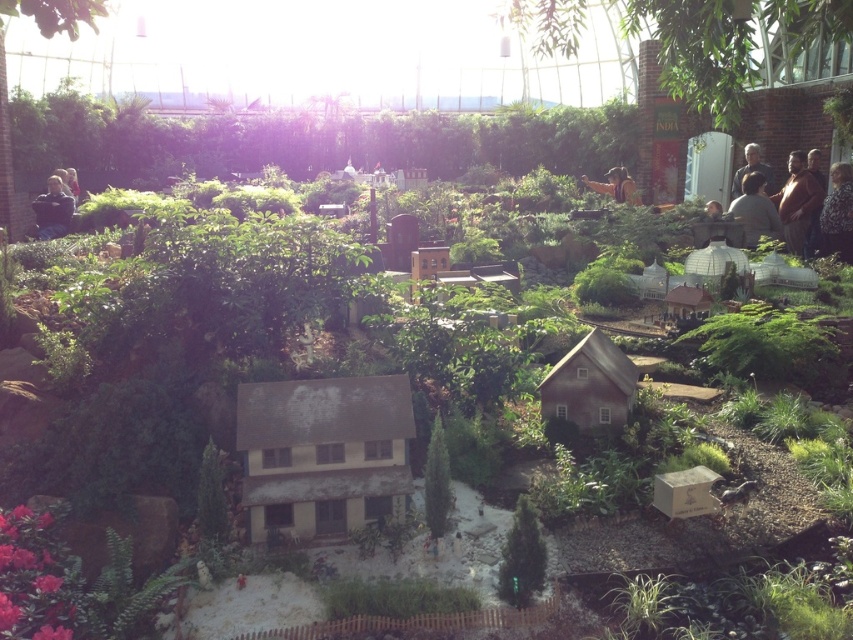
Does dark blue shirt at left appear under gray hair at upper right?

Indeed, dark blue shirt at left is positioned under gray hair at upper right.

Is dark blue shirt at left smaller than gray hair at upper right?

No.

Measure the distance between point (45, 204) and camera.

The distance of point (45, 204) from camera is 10.29 meters.

The width and height of the screenshot is (853, 640). What are the coordinates of `dark blue shirt at left` in the screenshot? It's located at (51, 209).

The image size is (853, 640). Describe the element at coordinates (310, 141) in the screenshot. I see `green leafy plants at upper center` at that location.

Does green leafy plants at upper center have a lesser width compared to brown leather jacket at upper center?

Incorrect, green leafy plants at upper center's width is not less than brown leather jacket at upper center's.

What do you see at coordinates (310, 141) in the screenshot? I see `green leafy plants at upper center` at bounding box center [310, 141].

You are a GUI agent. You are given a task and a screenshot of the screen. Output one action in this format:
    pyautogui.click(x=<x>, y=<y>)
    Task: Click on the green leafy plants at upper center
    Image resolution: width=853 pixels, height=640 pixels.
    Given the screenshot: What is the action you would take?
    pyautogui.click(x=310, y=141)

Does brown leather jacket at upper right have a lesser width compared to fluffy brown coat at right?

No, brown leather jacket at upper right is not thinner than fluffy brown coat at right.

Describe the element at coordinates (798, 202) in the screenshot. I see `brown leather jacket at upper right` at that location.

In order to click on brown leather jacket at upper right in this screenshot , I will do `click(798, 202)`.